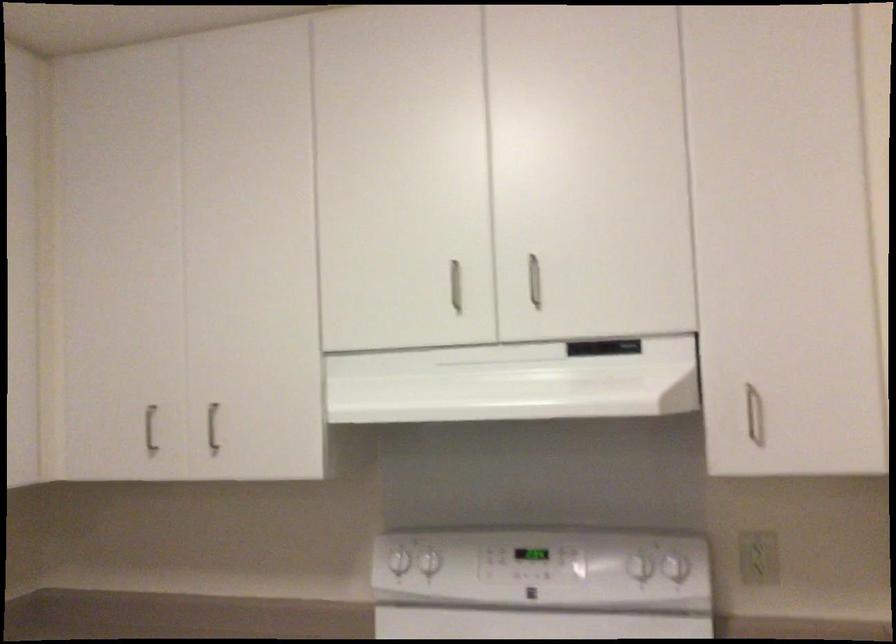
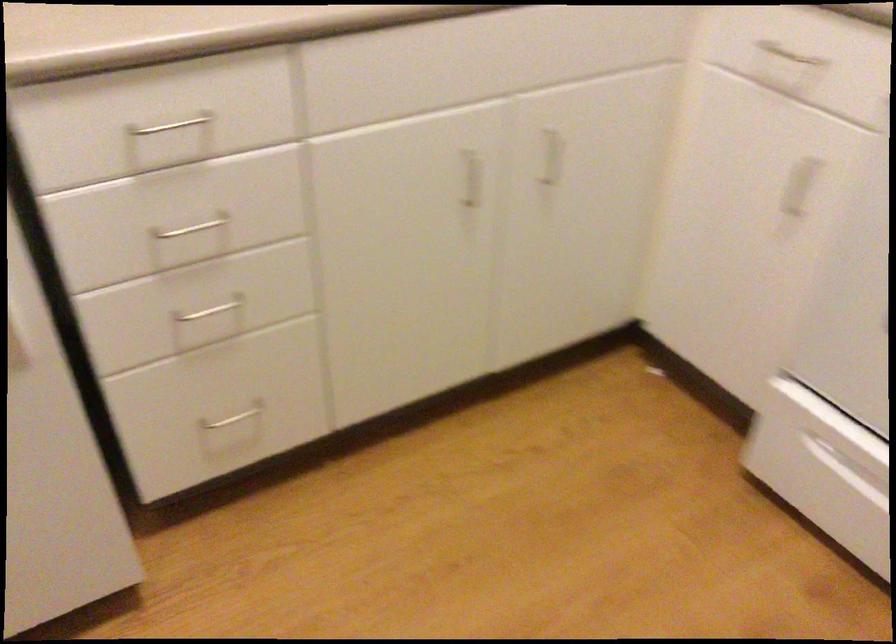
The first image is from the beginning of the video and the second image is from the end. How did the camera likely rotate when shooting the video?

The rotation direction of the camera is left-down.